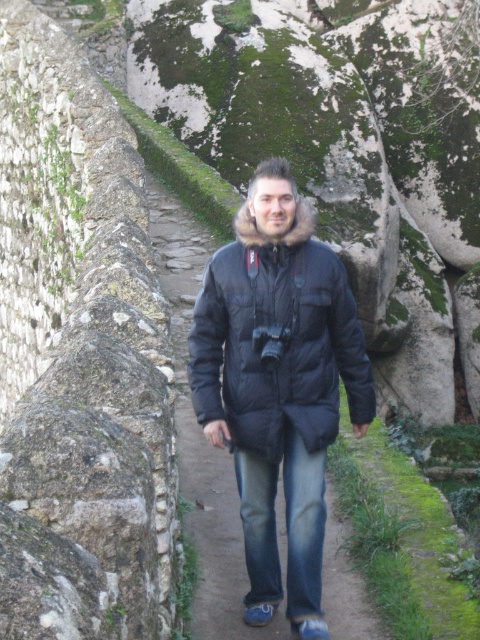
Question: Can you confirm if matte black jacket at center is smaller than black matte jacket at center?

Choices:
 (A) yes
 (B) no

Answer: (A)

Question: Which point is farther to the camera?

Choices:
 (A) matte black jacket at center
 (B) denim jeans at center
 (C) black matte jacket at center

Answer: (A)

Question: Among these points, which one is farthest from the camera?

Choices:
 (A) (267, 528)
 (B) (181, 282)
 (C) (240, 365)

Answer: (B)

Question: Is black matte jacket at center above denim jeans at center?

Choices:
 (A) no
 (B) yes

Answer: (B)

Question: Does matte black jacket at center appear on the right side of black matte jacket at center?

Choices:
 (A) no
 (B) yes

Answer: (B)

Question: Based on their relative distances, which object is farther from the black matte jacket at center?

Choices:
 (A) denim jeans at center
 (B) matte black jacket at center

Answer: (B)